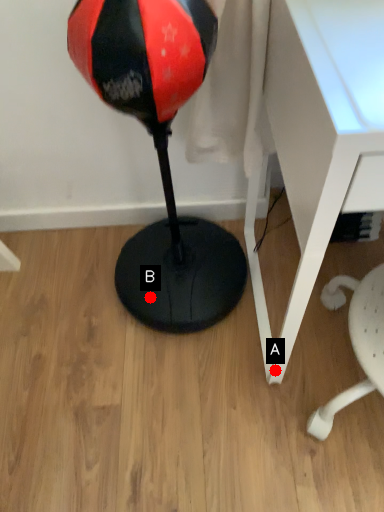
Question: Two points are circled on the image, labeled by A and B beside each circle. Which point is closer to the camera?

Choices:
 (A) A is closer
 (B) B is closer

Answer: (A)